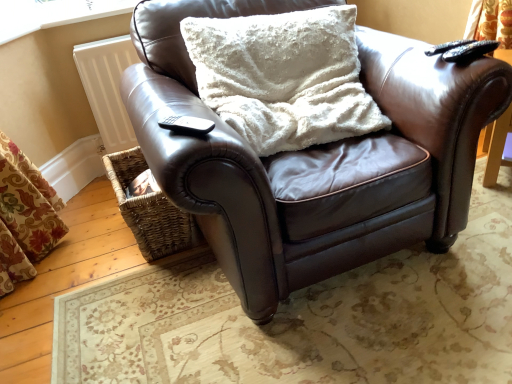
Question: Considering the relative positions of black plastic remote at lower left, acting as the 1th remote starting from the bottom, and woven brown basket at lower left in the image provided, is black plastic remote at lower left, acting as the 1th remote starting from the bottom, to the right of woven brown basket at lower left from the viewer's perspective?

Choices:
 (A) yes
 (B) no

Answer: (A)

Question: Is black plastic remote at lower left, placed as the first remote when sorted from front to back, positioned behind woven brown basket at lower left?

Choices:
 (A) yes
 (B) no

Answer: (B)

Question: Is black plastic remote at lower left, acting as the 1th remote starting from the bottom, bigger than woven brown basket at lower left?

Choices:
 (A) yes
 (B) no

Answer: (B)

Question: Is black plastic remote at lower left, placed as the first remote when sorted from front to back, at the left side of woven brown basket at lower left?

Choices:
 (A) yes
 (B) no

Answer: (B)

Question: From the image's perspective, does black plastic remote at lower left, the first remote positioned from the left, appear higher than woven brown basket at lower left?

Choices:
 (A) yes
 (B) no

Answer: (A)

Question: Is black plastic remote at lower left, positioned as the 2th remote in top-to-bottom order, next to woven brown basket at lower left?

Choices:
 (A) yes
 (B) no

Answer: (B)

Question: Could brown leather chair at center be considered to be inside black plastic remote at lower left, positioned as the 2th remote in top-to-bottom order?

Choices:
 (A) yes
 (B) no

Answer: (B)

Question: Considering the relative sizes of black plastic remote at lower left, acting as the 1th remote starting from the bottom, and brown leather chair at center in the image provided, is black plastic remote at lower left, acting as the 1th remote starting from the bottom, wider than brown leather chair at center?

Choices:
 (A) yes
 (B) no

Answer: (B)

Question: Is black plastic remote at lower left, marked as the second remote in a back-to-front arrangement, facing away from brown leather chair at center?

Choices:
 (A) no
 (B) yes

Answer: (B)

Question: Can you confirm if black plastic remote at lower left, positioned as the 2th remote in top-to-bottom order, is positioned to the left of brown leather chair at center?

Choices:
 (A) no
 (B) yes

Answer: (B)

Question: Is black plastic remote at lower left, marked as the second remote in a back-to-front arrangement, outside of brown leather chair at center?

Choices:
 (A) no
 (B) yes

Answer: (A)

Question: Is black plastic remote at lower left, acting as the 1th remote starting from the bottom, behind brown leather chair at center?

Choices:
 (A) yes
 (B) no

Answer: (A)

Question: Is black plastic remote at lower left, the first remote positioned from the left, smaller than black matte remote at upper right, which ranks as the 2th remote in left-to-right order?

Choices:
 (A) yes
 (B) no

Answer: (A)